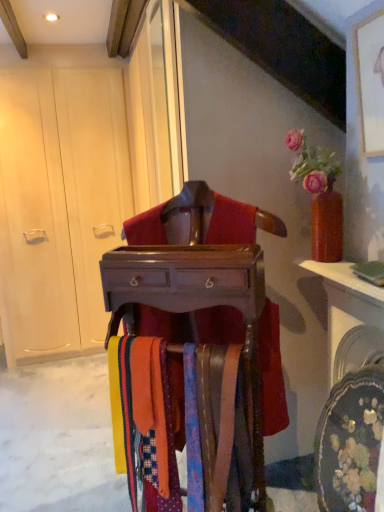
Question: Does wooden chest at center appear on the left side of matte white armoire at left?

Choices:
 (A) yes
 (B) no

Answer: (B)

Question: Considering the relative sizes of wooden chest at center and matte white armoire at left in the image provided, is wooden chest at center thinner than matte white armoire at left?

Choices:
 (A) no
 (B) yes

Answer: (B)

Question: Is wooden chest at center aimed at matte white armoire at left?

Choices:
 (A) yes
 (B) no

Answer: (B)

Question: From the image's perspective, is wooden chest at center above matte white armoire at left?

Choices:
 (A) no
 (B) yes

Answer: (A)

Question: Is the position of wooden chest at center more distant than that of matte white armoire at left?

Choices:
 (A) no
 (B) yes

Answer: (A)

Question: From a real-world perspective, is wooden chest at center positioned under matte white armoire at left based on gravity?

Choices:
 (A) yes
 (B) no

Answer: (A)

Question: Would you consider matte white armoire at left to be distant from wooden chest at center?

Choices:
 (A) yes
 (B) no

Answer: (A)

Question: Is matte white armoire at left looking in the opposite direction of wooden chest at center?

Choices:
 (A) no
 (B) yes

Answer: (A)

Question: From a real-world perspective, is matte white armoire at left under wooden chest at center?

Choices:
 (A) no
 (B) yes

Answer: (A)

Question: Does matte white armoire at left have a greater height compared to wooden chest at center?

Choices:
 (A) no
 (B) yes

Answer: (B)

Question: Is matte white armoire at left at the left side of wooden chest at center?

Choices:
 (A) no
 (B) yes

Answer: (B)

Question: Are matte white armoire at left and wooden chest at center beside each other?

Choices:
 (A) yes
 (B) no

Answer: (B)

Question: In terms of width, does wooden chest at center look wider or thinner when compared to matte white armoire at left?

Choices:
 (A) thin
 (B) wide

Answer: (A)